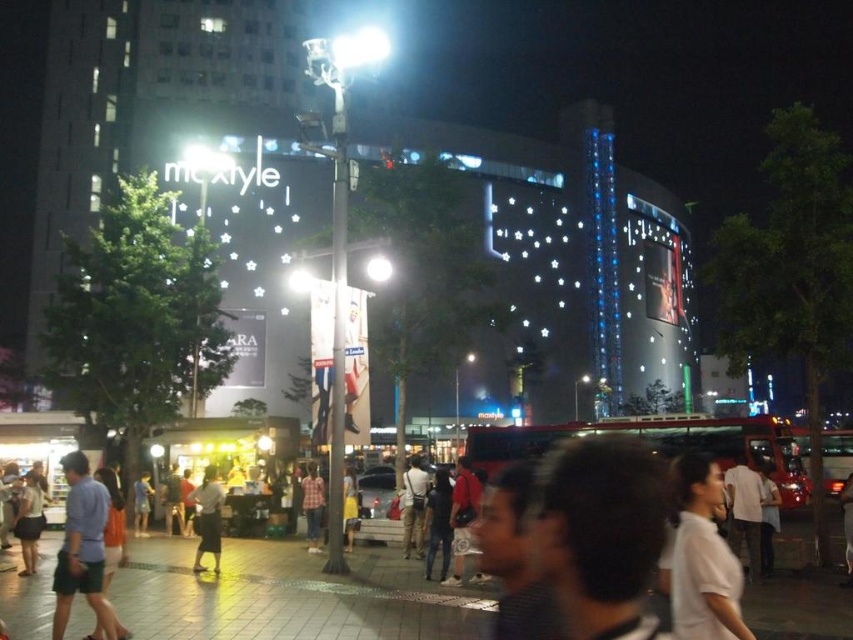
Question: Is light blue cotton shirt at lower left to the right of light gray fabric skirt at center from the viewer's perspective?

Choices:
 (A) yes
 (B) no

Answer: (B)

Question: Is white matte shirt at center closer to the viewer compared to light gray fabric skirt at center?

Choices:
 (A) yes
 (B) no

Answer: (A)

Question: Which of the following is the farthest from the observer?

Choices:
 (A) (202, 540)
 (B) (735, 593)
 (C) (317, 476)

Answer: (C)

Question: Which point appears closest to the camera in this image?

Choices:
 (A) (312, 476)
 (B) (202, 508)

Answer: (B)

Question: Which point appears farthest from the camera in this image?

Choices:
 (A) (206, 477)
 (B) (746, 632)

Answer: (A)

Question: Does light gray fabric skirt at center have a larger size compared to plaid shirt at center?

Choices:
 (A) no
 (B) yes

Answer: (B)